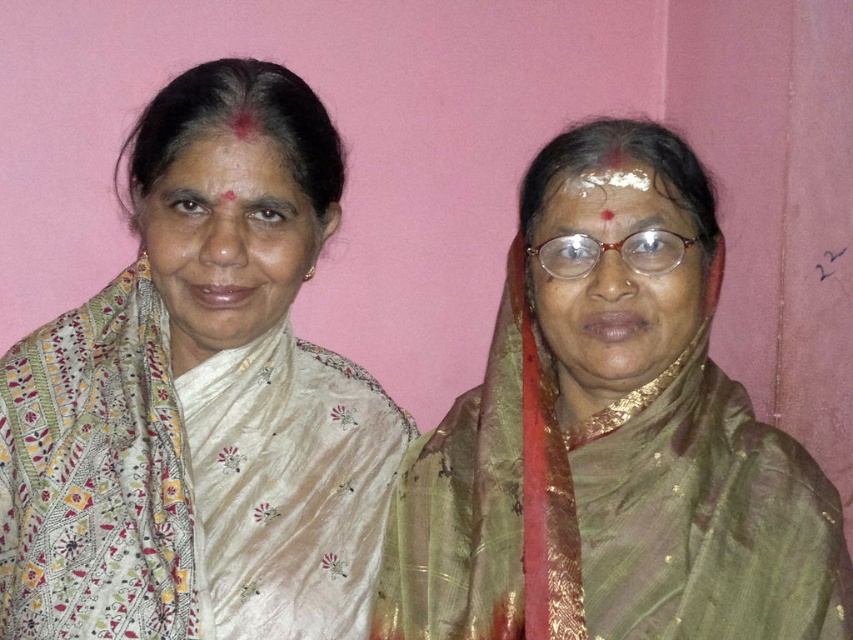
Who is positioned more to the right, green silk saree at center or matte white saree at left?

green silk saree at center

Which of these two, green silk saree at center or matte white saree at left, stands taller?

Standing taller between the two is green silk saree at center.

What do you see at coordinates (611, 460) in the screenshot?
I see `green silk saree at center` at bounding box center [611, 460].

The width and height of the screenshot is (853, 640). What are the coordinates of `green silk saree at center` in the screenshot? It's located at (611, 460).

Does matte white saree at left appear under white powder at center?

Correct, matte white saree at left is located below white powder at center.

How much distance is there between matte white saree at left and white powder at center?

matte white saree at left is 10.91 inches away from white powder at center.

Does point (210, 244) lie in front of point (633, 184)?

No.

Find the location of a particular element. matte white saree at left is located at coordinates (227, 241).

Is white silk saree at left below white powder at center?

Yes, white silk saree at left is below white powder at center.

Is point (350, 490) closer to viewer compared to point (560, 168)?

That is False.

Locate an element on the screen. The height and width of the screenshot is (640, 853). white silk saree at left is located at coordinates (200, 397).